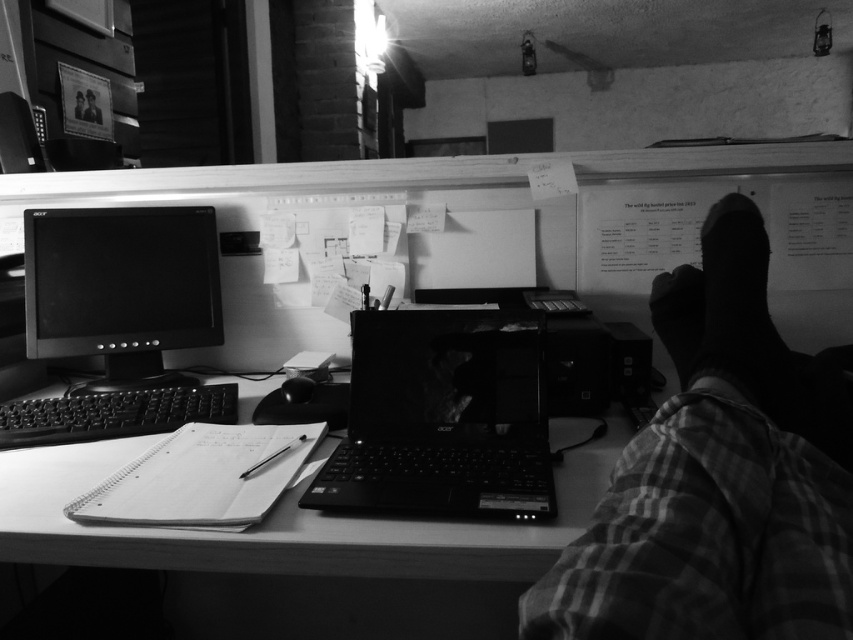
You are organizing the desk and need to place a new item on the surface. Which object, the plaid fabric leg at right or the smooth plastic computer desk at center, is the best place to put it based on their positions?

The smooth plastic computer desk at center is the best place to put the new item because the plaid fabric leg at right is above it, meaning the desk is the flat surface available for placement.

From the picture: You are trying to place a new rectangular box on the desk. The box is as wide as the plaid fabric leg at right. Will it fit next to the matte black monitor at left without overlapping?

The plaid fabric leg at right might be wider than the matte black monitor at left, so placing a box as wide as the plaid fabric leg at right next to the matte black monitor at left may cause overlapping since the box could be wider than the space available.

You are taking a photo of the desk setup. You want to focus on the point at coordinates point (647,627) and point (45,538). Which point should you focus on first if you want to ensure both points are in focus?

You should focus on point (647,627) first because it is closer to the camera, so adjusting the focus from there will help both points come into focus.